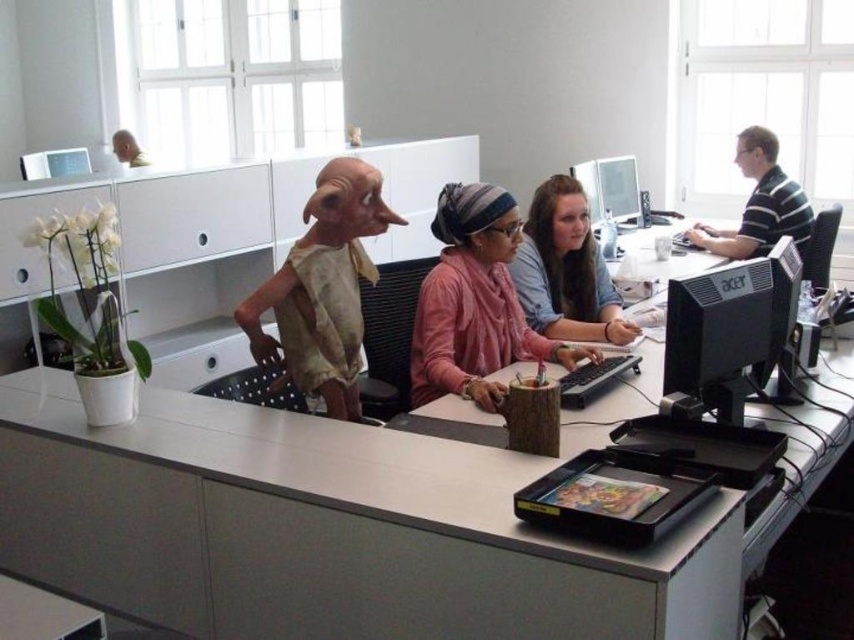
You are organizing a presentation and need to place a large poster on the desk. The poster requires a space wider than the matte black monitor at upper right. Can the matte beige costume at center provide enough width for the poster?

The matte beige costume at center might be wider than matte black monitor at upper right, so it could potentially accommodate the poster if the costume is indeed wider.

You are standing at the entrance of the office and want to locate the black plastic monitor at center right. According to the coordinates provided, where would you look to find it?

The black plastic monitor at center right is located at coordinates point (730, 328).

You are an office worker who needs to reach both the matte beige costume at center and the matte black monitor at upper right. Which object is closer to your hand if you are sitting at the desk?

The matte beige costume at center is closer to your hand because it is positioned below the matte black monitor at upper right, which is higher up.